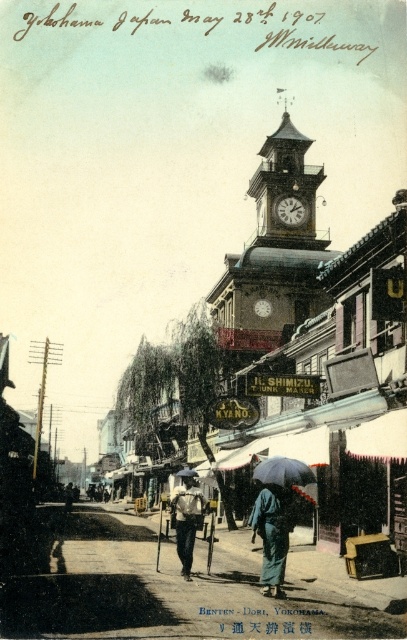
Does light brown fabric pants at center have a greater height compared to black matte umbrella at center?

Yes.

Does light brown fabric pants at center have a greater width compared to black matte umbrella at center?

Correct, the width of light brown fabric pants at center exceeds that of black matte umbrella at center.

Consider the image. Who is more distant from viewer, (177, 497) or (284, 472)?

The point (177, 497) is behind.

You are a GUI agent. You are given a task and a screenshot of the screen. Output one action in this format:
    pyautogui.click(x=<x>, y=<y>)
    Task: Click on the light brown fabric pants at center
    The width and height of the screenshot is (407, 640).
    Given the screenshot: What is the action you would take?
    pyautogui.click(x=186, y=518)

Does green fabric kimono at center come in front of light brown fabric pants at center?

Yes, it is.

Does point (256, 532) come closer to viewer compared to point (185, 538)?

No, it is behind (185, 538).

In order to click on green fabric kimono at center in this screenshot , I will do `click(271, 536)`.

Does point (181, 531) lie in front of point (190, 470)?

Yes, it is in front of point (190, 470).

Can you confirm if light brown fabric pants at center is smaller than transparent blue umbrella at center?

No.

Is point (183, 496) positioned before point (196, 472)?

That is True.

At what (x,y) coordinates should I click in order to perform the action: click on light brown fabric pants at center. Please return your answer as a coordinate pair (x, y). This screenshot has width=407, height=640. Looking at the image, I should click on (186, 518).